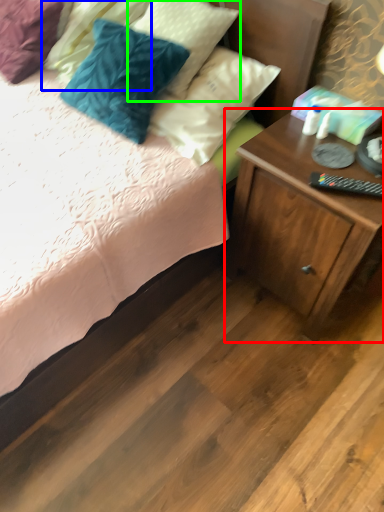
Question: Which object is positioned closest to nightstand (highlighted by a red box)? Select from pillow (highlighted by a blue box) and pillow (highlighted by a green box).

Choices:
 (A) pillow
 (B) pillow

Answer: (B)